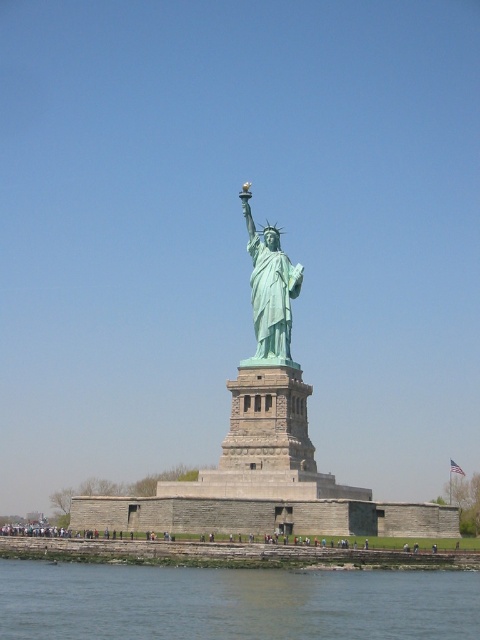
Question: Which point appears farthest from the camera in this image?

Choices:
 (A) (302, 269)
 (B) (110, 618)

Answer: (A)

Question: Does greenish water at lower center appear over green patina statue at center?

Choices:
 (A) no
 (B) yes

Answer: (A)

Question: Is greenish water at lower center positioned before green patina statue at center?

Choices:
 (A) no
 (B) yes

Answer: (B)

Question: Is greenish water at lower center further to the viewer compared to green patina statue at center?

Choices:
 (A) yes
 (B) no

Answer: (B)